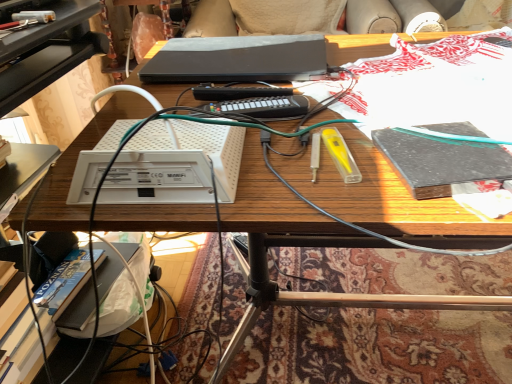
Find the location of `vacant point to the right of black matte laptop at center`. vacant point to the right of black matte laptop at center is located at coordinates (389, 62).